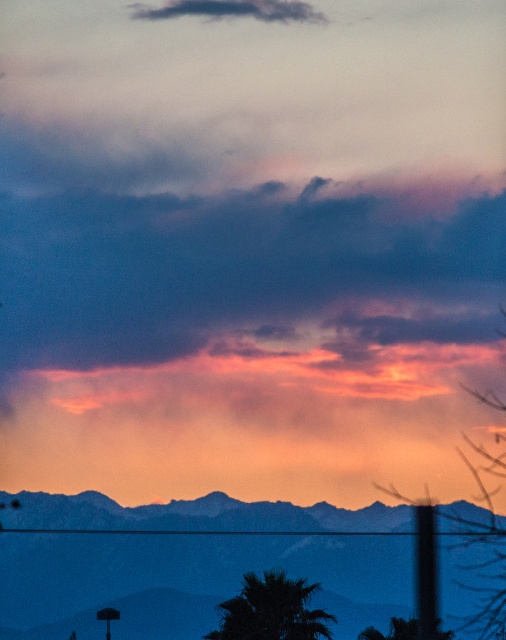
Question: Can you confirm if silhouetted rocky mountains at lower center is positioned above cloudy sky at upper center?

Choices:
 (A) yes
 (B) no

Answer: (B)

Question: Which of the following is the farthest from the observer?

Choices:
 (A) dark purple cloud at upper center
 (B) cloudy sky at upper center
 (C) silhouetted rocky mountains at lower center
 (D) silvery metallic mountains at center

Answer: (B)

Question: Observing the image, what is the correct spatial positioning of dark purple cloud at upper center in reference to silhouetted rocky mountains at lower center?

Choices:
 (A) left
 (B) right

Answer: (A)

Question: Which point appears closest to the camera in this image?

Choices:
 (A) (316, 508)
 (B) (49, 509)

Answer: (B)

Question: Which point is closer to the camera?

Choices:
 (A) (77, 493)
 (B) (389, 579)

Answer: (B)

Question: Can you confirm if dark purple cloud at upper center is smaller than silvery metallic mountains at center?

Choices:
 (A) no
 (B) yes

Answer: (B)